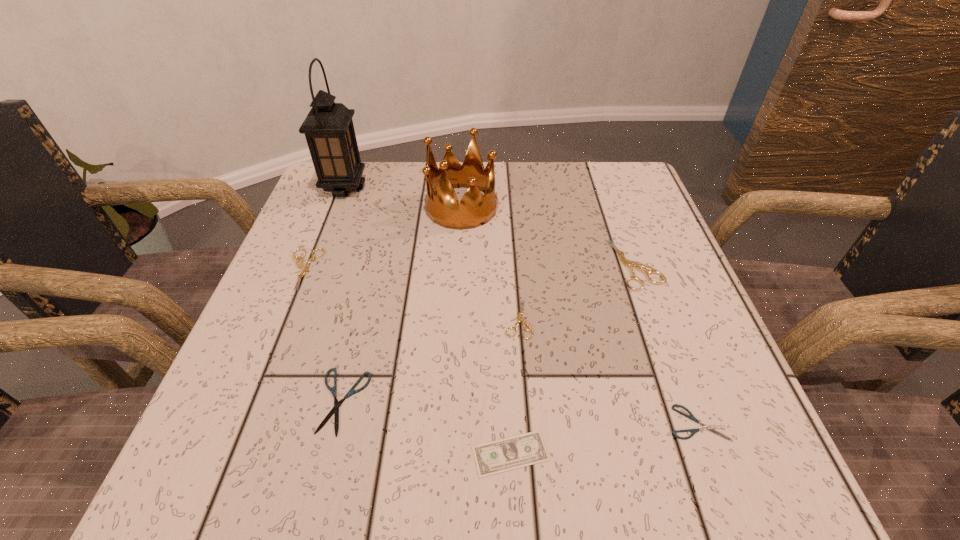
Locate which beige shears ranks in proximity to the money. Please provide its 2D coordinates. Your answer should be formatted as a tuple, i.e. [(x, y)], where the tuple contains the x and y coordinates of a point satisfying the conditions above.

[(519, 318)]

The height and width of the screenshot is (540, 960). What are the coordinates of `free space that satisfies the following two spatial constraints: 1. on the front side of the right black shears; 2. on the left side of the third nearest shears` in the screenshot? It's located at (526, 423).

This screenshot has width=960, height=540. I want to click on vacant space that satisfies the following two spatial constraints: 1. on the front side of the rightmost beige shears; 2. on the right side of the tallest object, so click(x=315, y=264).